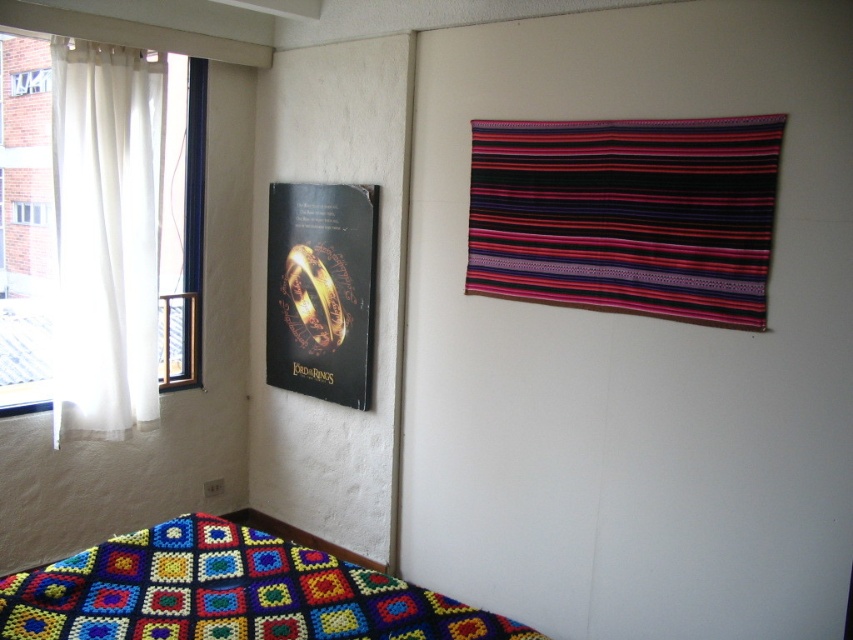
Can you confirm if white sheer curtain at left is positioned to the left of black paper poster at left?

Indeed, white sheer curtain at left is positioned on the left side of black paper poster at left.

Between white sheer curtain at left and black paper poster at left, which one is positioned higher?

white sheer curtain at left is above.

Identify the location of white sheer curtain at left. (106, 236).

Between multicolored woven tapestry at upper right and multicolored crocheted quilt at lower left, which one has less height?

Standing shorter between the two is multicolored crocheted quilt at lower left.

Is multicolored woven tapestry at upper right shorter than multicolored crocheted quilt at lower left?

No, multicolored woven tapestry at upper right is not shorter than multicolored crocheted quilt at lower left.

Does point (480, 230) lie behind point (369, 628)?

Yes.

Identify the location of multicolored woven tapestry at upper right. (625, 214).

Does multicolored woven tapestry at upper right have a smaller size compared to black paper poster at left?

Incorrect, multicolored woven tapestry at upper right is not smaller in size than black paper poster at left.

Who is shorter, multicolored woven tapestry at upper right or black paper poster at left?

multicolored woven tapestry at upper right

Which is in front, point (563, 148) or point (338, 333)?

Positioned in front is point (563, 148).

Locate an element on the screen. multicolored woven tapestry at upper right is located at coordinates (625, 214).